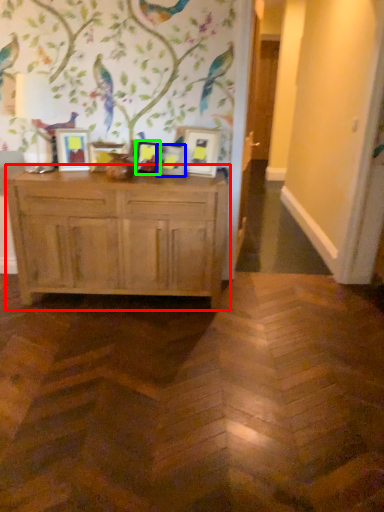
Question: Which is nearer to the chest of drawers (highlighted by a red box)? picture frame (highlighted by a blue box) or picture frame (highlighted by a green box).

Choices:
 (A) picture frame
 (B) picture frame

Answer: (B)